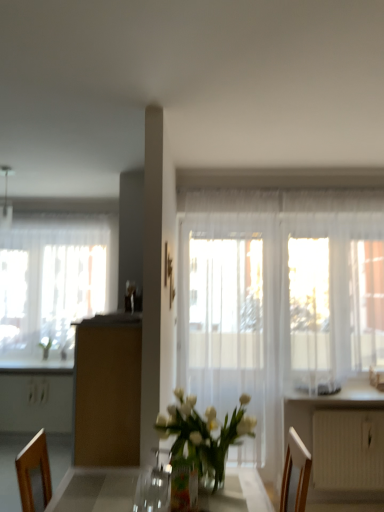
Question: Is brown matte cabinet at center touching metallic silver lamp at upper left?

Choices:
 (A) yes
 (B) no

Answer: (B)

Question: Can you confirm if brown matte cabinet at center is shorter than metallic silver lamp at upper left?

Choices:
 (A) yes
 (B) no

Answer: (B)

Question: Is brown matte cabinet at center closer to the viewer compared to metallic silver lamp at upper left?

Choices:
 (A) yes
 (B) no

Answer: (A)

Question: Does brown matte cabinet at center have a lesser width compared to metallic silver lamp at upper left?

Choices:
 (A) no
 (B) yes

Answer: (A)

Question: Considering the relative sizes of brown matte cabinet at center and metallic silver lamp at upper left in the image provided, is brown matte cabinet at center smaller than metallic silver lamp at upper left?

Choices:
 (A) no
 (B) yes

Answer: (A)

Question: Considering their positions, is white glossy counter top at lower right located in front of or behind metallic silver lamp at upper left?

Choices:
 (A) front
 (B) behind

Answer: (A)

Question: From a real-world perspective, is white glossy counter top at lower right physically located above or below metallic silver lamp at upper left?

Choices:
 (A) below
 (B) above

Answer: (A)

Question: Based on their positions, is white glossy counter top at lower right located to the left or right of metallic silver lamp at upper left?

Choices:
 (A) right
 (B) left

Answer: (A)

Question: Is white glossy counter top at lower right bigger or smaller than metallic silver lamp at upper left?

Choices:
 (A) small
 (B) big

Answer: (B)

Question: In the image, is white textured radiator at lower right on the left side or the right side of translucent fabric screen door at center?

Choices:
 (A) right
 (B) left

Answer: (A)

Question: Considering the positions of white textured radiator at lower right and translucent fabric screen door at center in the image, is white textured radiator at lower right taller or shorter than translucent fabric screen door at center?

Choices:
 (A) short
 (B) tall

Answer: (A)

Question: From the image's perspective, is white textured radiator at lower right positioned above or below translucent fabric screen door at center?

Choices:
 (A) above
 (B) below

Answer: (B)

Question: In terms of size, does white textured radiator at lower right appear bigger or smaller than translucent fabric screen door at center?

Choices:
 (A) small
 (B) big

Answer: (A)

Question: Is metallic silver lamp at upper left inside the boundaries of translucent glass vase at center, or outside?

Choices:
 (A) outside
 (B) inside

Answer: (A)

Question: From a real-world perspective, is metallic silver lamp at upper left above or below translucent glass vase at center?

Choices:
 (A) above
 (B) below

Answer: (A)